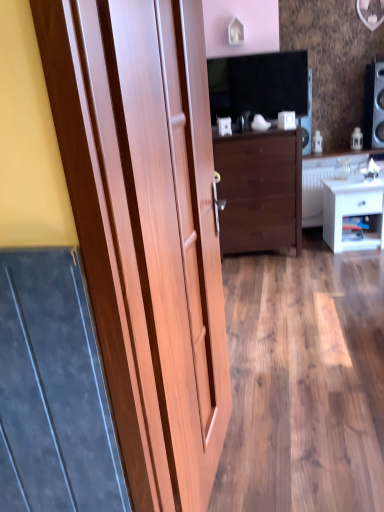
The width and height of the screenshot is (384, 512). In order to click on vacant space in between dark wood chest of drawers at center and white glossy nightstand at lower right in this screenshot , I will do `click(309, 243)`.